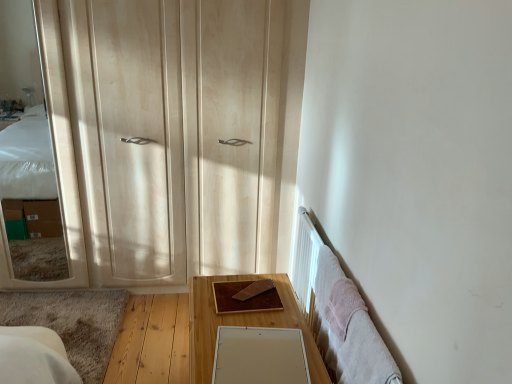
I want to click on free area below white matte mirror at lower center, the first mirror when ordered from front to back (from a real-world perspective), so click(x=258, y=356).